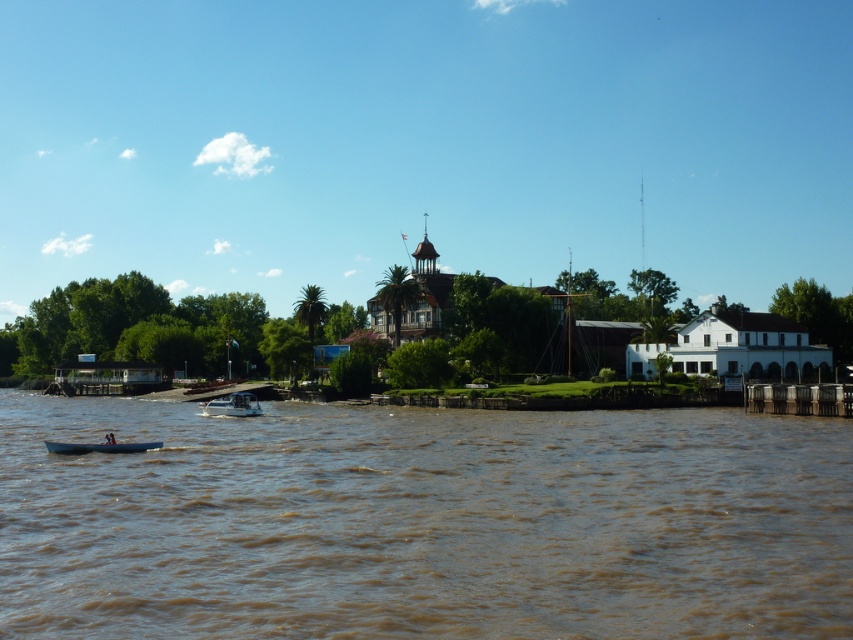
Question: Is white glossy boat at center positioned before blue plastic boat at center?

Choices:
 (A) no
 (B) yes

Answer: (A)

Question: Can you confirm if brown muddy water at lower center is wider than white glossy boat at center?

Choices:
 (A) yes
 (B) no

Answer: (A)

Question: Among these points, which one is farthest from the camera?

Choices:
 (A) (241, 397)
 (B) (96, 444)

Answer: (A)

Question: Which point is closer to the camera?

Choices:
 (A) (302, 506)
 (B) (228, 413)
 (C) (126, 449)

Answer: (A)

Question: Considering the relative positions of brown muddy water at lower center and white glossy boat at center in the image provided, where is brown muddy water at lower center located with respect to white glossy boat at center?

Choices:
 (A) below
 (B) above

Answer: (B)

Question: Which object is the closest to the white glossy boat at center?

Choices:
 (A) blue plastic boat at center
 (B) brown muddy water at lower center

Answer: (B)